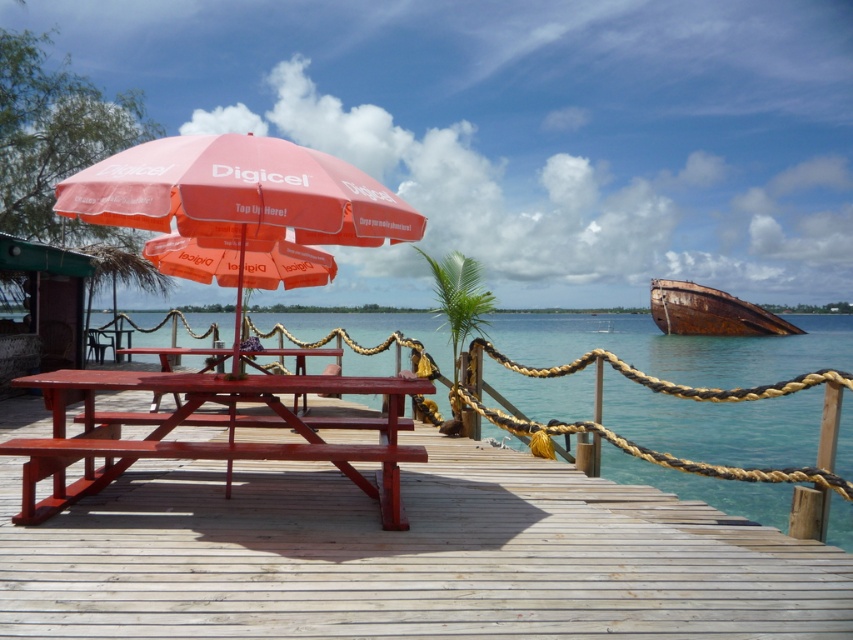
Which is above, clear blue water at center or smooth wood table at center?

Positioned higher is clear blue water at center.

From the picture: Who is more forward, (653, 349) or (289, 349)?

Point (289, 349) is in front.

Does point (552, 364) come in front of point (225, 356)?

That is False.

Find the location of `clear blue water at center`. clear blue water at center is located at coordinates (677, 346).

Who is shorter, matte red picnic table at center or orange fabric umbrella at center?

orange fabric umbrella at center

Describe the element at coordinates (200, 422) in the screenshot. The image size is (853, 640). I see `matte red picnic table at center` at that location.

Locate an element on the screen. Image resolution: width=853 pixels, height=640 pixels. matte red picnic table at center is located at coordinates (200, 422).

Between point (167, 422) and point (759, 317), which one is positioned in front?

Point (167, 422) is more forward.

Can you confirm if matte red picnic table at center is positioned above rusty metal boat at right?

No.

Locate an element on the screen. matte red picnic table at center is located at coordinates (200, 422).